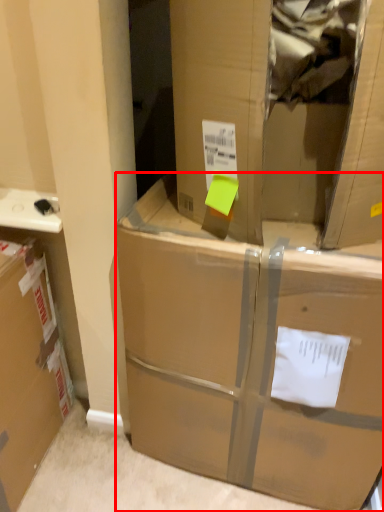
Question: Considering the relative positions of box (annotated by the red box) and cardboard box in the image provided, where is box (annotated by the red box) located with respect to the staircase?

Choices:
 (A) right
 (B) left

Answer: (B)